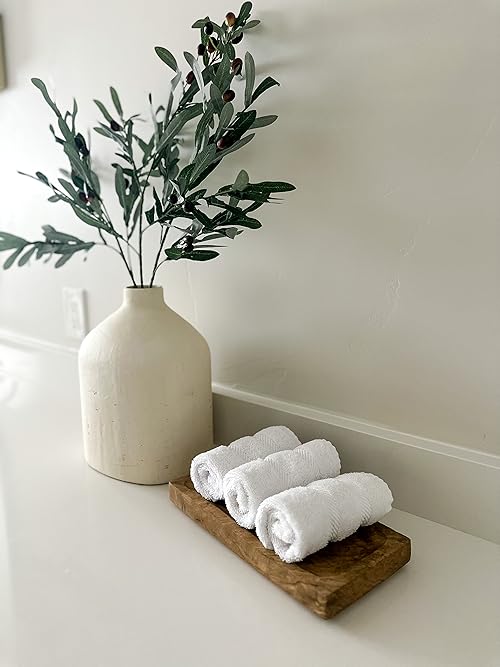
The width and height of the screenshot is (500, 667). I want to click on vase, so click(113, 388).